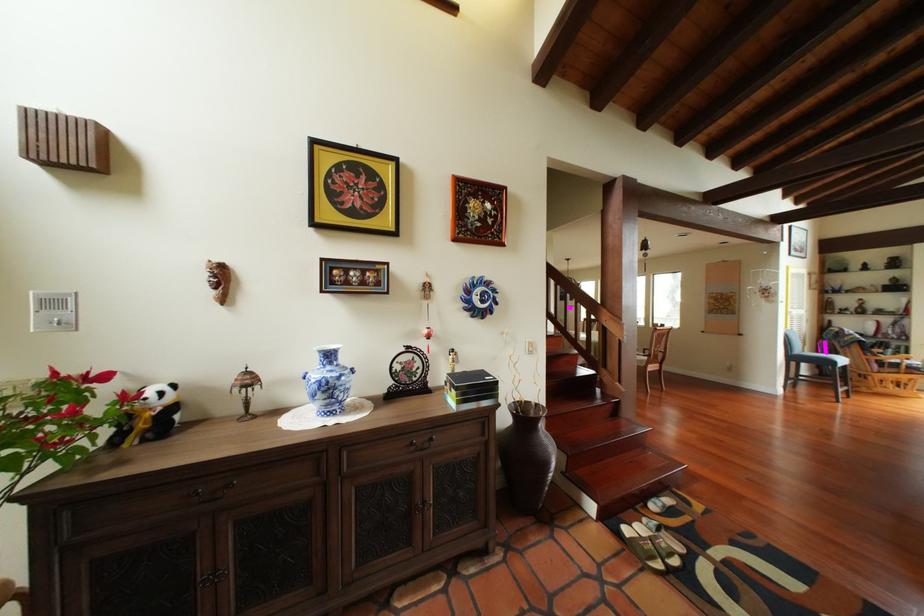
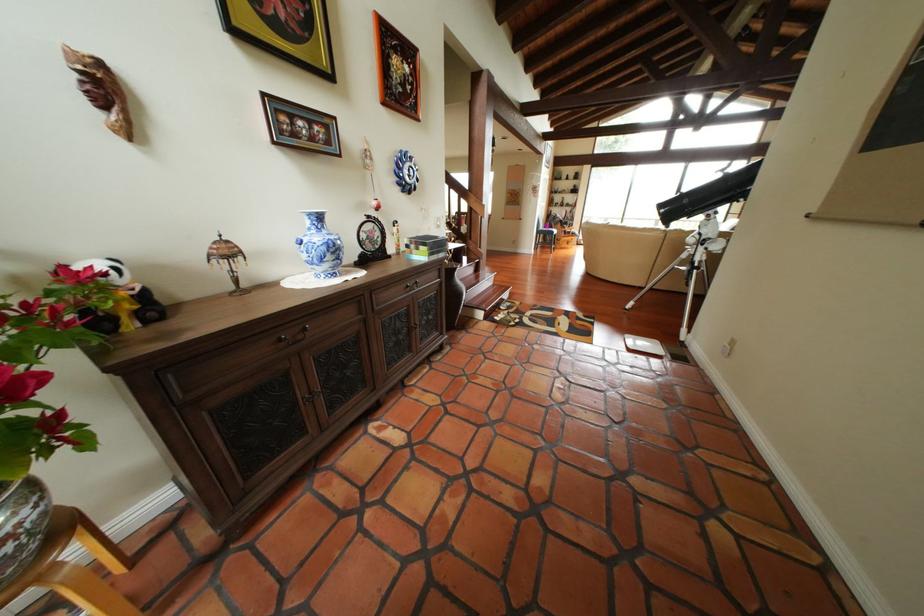
The point at (211, 496) is marked in the first image. Where is the corresponding point in the second image?

(298, 339)